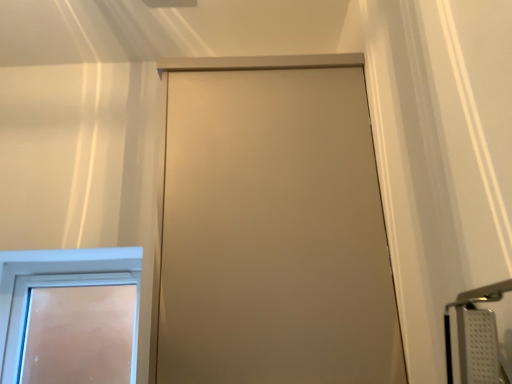
Question: Which is correct: satin beige door at center, marked as the second door in a back-to-front arrangement, is inside white frosted glass door at lower left, which appears as the 2th door when viewed from the front, or outside of it?

Choices:
 (A) inside
 (B) outside

Answer: (B)

Question: Looking at the image, does satin beige door at center, which is the second door from left to right, seem bigger or smaller compared to white frosted glass door at lower left, marked as the first door in a left-to-right arrangement?

Choices:
 (A) big
 (B) small

Answer: (A)

Question: Visually, is satin beige door at center, acting as the first door starting from the front, positioned to the left or to the right of white frosted glass door at lower left, marked as the first door in a left-to-right arrangement?

Choices:
 (A) left
 (B) right

Answer: (B)

Question: Considering the positions of white frosted glass door at lower left, which is the 2th door from right to left, and satin beige door at center, marked as the second door in a back-to-front arrangement, in the image, is white frosted glass door at lower left, which is the 2th door from right to left, wider or thinner than satin beige door at center, marked as the second door in a back-to-front arrangement,?

Choices:
 (A) thin
 (B) wide

Answer: (A)

Question: From the image's perspective, relative to satin beige door at center, marked as the second door in a back-to-front arrangement, is white frosted glass door at lower left, marked as the first door in a left-to-right arrangement, above or below?

Choices:
 (A) below
 (B) above

Answer: (A)

Question: Is white frosted glass door at lower left, marked as the first door in a back-to-front arrangement, in front of or behind satin beige door at center, acting as the first door starting from the front, in the image?

Choices:
 (A) behind
 (B) front

Answer: (A)

Question: Considering the positions of point (84, 369) and point (208, 337), is point (84, 369) closer or farther from the camera than point (208, 337)?

Choices:
 (A) closer
 (B) farther

Answer: (B)